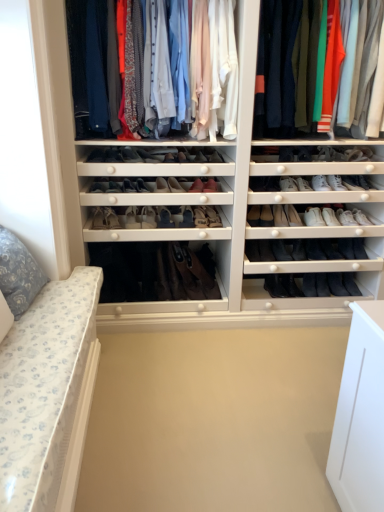
This screenshot has width=384, height=512. Describe the element at coordinates (113, 155) in the screenshot. I see `matte white shoe at center, which is the 5th shoe from left to right` at that location.

This screenshot has height=512, width=384. Describe the element at coordinates (148, 217) in the screenshot. I see `leather boot at center, which appears as the sixteenth shoe when viewed from the right` at that location.

Where is `matte cotton t-shirts at upper right, positioned as the 1th clothing in right-to-left order`? This screenshot has width=384, height=512. matte cotton t-shirts at upper right, positioned as the 1th clothing in right-to-left order is located at coordinates (291, 65).

This screenshot has height=512, width=384. In order to click on leather boot at center, placed as the 2th shoe when sorted from left to right in this screenshot , I will do `click(96, 156)`.

Locate an element on the screen. leather boot at center, the eleventh shoe when ordered from left to right is located at coordinates (161, 185).

From a real-world perspective, does black leather boot at lower center, the fourth shoe when ordered from right to left, sit lower than floral fabric pillow at left?

Indeed, from a real-world perspective, black leather boot at lower center, the fourth shoe when ordered from right to left, is positioned beneath floral fabric pillow at left.

Consider the image. Based on their positions, is black leather boot at lower center, the fourth shoe when ordered from right to left, located to the left or right of floral fabric pillow at left?

From the image, it's evident that black leather boot at lower center, the fourth shoe when ordered from right to left, is to the right of floral fabric pillow at left.

Considering the positions of objects black leather boot at lower center, the fourth shoe when ordered from right to left, and floral fabric pillow at left in the image provided, who is in front, black leather boot at lower center, the fourth shoe when ordered from right to left, or floral fabric pillow at left?

floral fabric pillow at left is more forward.

From the image's perspective, which one is positioned lower, black leather boot at lower center, acting as the 21th shoe starting from the left, or floral fabric pillow at left?

black leather boot at lower center, acting as the 21th shoe starting from the left.

Which is farther, (198, 209) or (148, 162)?

The point (198, 209) is more distant.

From a real-world perspective, is leather boot at center, placed as the eighth shoe when sorted from right to left, below matte black shoe at center, the tenth shoe positioned from the left?

Yes, from a real-world perspective, leather boot at center, placed as the eighth shoe when sorted from right to left, is below matte black shoe at center, the tenth shoe positioned from the left.

Starting from the leather boot at center, which is counted as the 17th shoe, starting from the left, which shoe is the 7th one to the left? Please provide its 2D coordinates.

[(148, 156)]

Can you confirm if leather boot at center, placed as the eighth shoe when sorted from right to left, is positioned to the right of matte black shoe at center, the tenth shoe positioned from the left?

Yes, leather boot at center, placed as the eighth shoe when sorted from right to left, is to the right of matte black shoe at center, the tenth shoe positioned from the left.

Who is taller, matte black shoe at center, which ranks as the 15th shoe in right-to-left order, or matte black shoe at center, which is the eighth shoe from left to right?

matte black shoe at center, which is the eighth shoe from left to right, is taller.

In terms of size, does matte black shoe at center, the tenth shoe positioned from the left, appear bigger or smaller than matte black shoe at center, which is the seventeenth shoe from right to left?

Clearly, matte black shoe at center, the tenth shoe positioned from the left, is smaller in size than matte black shoe at center, which is the seventeenth shoe from right to left.

From a real-world perspective, does matte black shoe at center, which ranks as the 15th shoe in right-to-left order, sit lower than matte black shoe at center, which is the eighth shoe from left to right?

No, from a real-world perspective, matte black shoe at center, which ranks as the 15th shoe in right-to-left order, is not under matte black shoe at center, which is the eighth shoe from left to right.

From a real-world perspective, is matte black boot at center, arranged as the 10th shoe when viewed from the right, under black leather boot at lower center, the fourth shoe when ordered from right to left?

Actually, matte black boot at center, arranged as the 10th shoe when viewed from the right, is physically above black leather boot at lower center, the fourth shoe when ordered from right to left, in the real world.

Considering the sizes of matte black boot at center, arranged as the 10th shoe when viewed from the right, and black leather boot at lower center, acting as the 21th shoe starting from the left, in the image, is matte black boot at center, arranged as the 10th shoe when viewed from the right, wider or thinner than black leather boot at lower center, acting as the 21th shoe starting from the left,?

In the image, matte black boot at center, arranged as the 10th shoe when viewed from the right, appears to be wider than black leather boot at lower center, acting as the 21th shoe starting from the left.

Which of these two, matte black boot at center, acting as the fifteenth shoe starting from the left, or black leather boot at lower center, the fourth shoe when ordered from right to left, is smaller?

Smaller between the two is matte black boot at center, acting as the fifteenth shoe starting from the left.

Could you tell me if matte black boot at center, arranged as the 10th shoe when viewed from the right, is facing black leather boot at lower center, acting as the 21th shoe starting from the left?

No, matte black boot at center, arranged as the 10th shoe when viewed from the right, is not facing towards black leather boot at lower center, acting as the 21th shoe starting from the left.

Does leather boot at center, which is the 6th shoe from right to left, turn towards leather boot at center, the eleventh shoe when ordered from left to right?

No, leather boot at center, which is the 6th shoe from right to left, is not aimed at leather boot at center, the eleventh shoe when ordered from left to right.

Considering the sizes of objects leather boot at center, which is the 6th shoe from right to left, and leather boot at center, the 14th shoe viewed from the right, in the image provided, who is smaller, leather boot at center, which is the 6th shoe from right to left, or leather boot at center, the 14th shoe viewed from the right,?

leather boot at center, the 14th shoe viewed from the right.

Does point (217, 219) lie in front of point (164, 186)?

Yes, it is in front of point (164, 186).

Does leather boot at center, which is the 18th shoe from left to right, have a lesser width compared to matte black shoe at center, which is the seventeenth shoe from right to left?

No, leather boot at center, which is the 18th shoe from left to right, is not thinner than matte black shoe at center, which is the seventeenth shoe from right to left.

Which shoe is the 10th one when counting from the right side of the matte black shoe at center, which is the seventeenth shoe from right to left? Please provide its 2D coordinates.

[(211, 186)]

Does leather boot at center, which is the 18th shoe from left to right, appear on the right side of matte black shoe at center, which is the eighth shoe from left to right?

Yes.

Is leather boot at center, which ranks as the eleventh shoe in right-to-left order, with matte black shoe at center, which ranks as the 15th shoe in right-to-left order?

No, leather boot at center, which ranks as the eleventh shoe in right-to-left order, is not with matte black shoe at center, which ranks as the 15th shoe in right-to-left order.

Which is correct: leather boot at center, which ranks as the eleventh shoe in right-to-left order, is inside matte black shoe at center, the tenth shoe positioned from the left, or outside of it?

leather boot at center, which ranks as the eleventh shoe in right-to-left order, is spatially situated outside matte black shoe at center, the tenth shoe positioned from the left.

Find the location of `the 4th shoe counting from the left of the leather boot at center, the fourteenth shoe when ordered from left to right`. the 4th shoe counting from the left of the leather boot at center, the fourteenth shoe when ordered from left to right is located at coordinates (148, 156).

Locate an element on the screen. pillow on the left of black leather boot at lower center, acting as the 21th shoe starting from the left is located at coordinates (x=18, y=273).

Locate an element on the screen. Image resolution: width=384 pixels, height=512 pixels. the 15th shoe positioned above the leather boot at center, which is counted as the 17th shoe, starting from the left (from a real-world perspective) is located at coordinates click(148, 156).

When comparing their distances from leather boot at center, which ranks as the eleventh shoe in right-to-left order, does leather boot at center, the 21th shoe viewed from the right, or black leather boot at lower center, acting as the 21th shoe starting from the left, seem further?

black leather boot at lower center, acting as the 21th shoe starting from the left, is positioned further to the anchor leather boot at center, which ranks as the eleventh shoe in right-to-left order.

Which object lies further to the anchor point leather shoes at center, which ranks as the 22th shoe in right-to-left order, black leather shoe at lower right, the 3th shoe viewed from the right, or matte cotton t-shirts at upper right, placed as the 2th clothing when sorted from left to right?

Based on the image, matte cotton t-shirts at upper right, placed as the 2th clothing when sorted from left to right, appears to be further to leather shoes at center, which ranks as the 22th shoe in right-to-left order.

From the image, which object appears to be farther from matte black boot at center, acting as the fifteenth shoe starting from the left, matte black shoe at center, which ranks as the 15th shoe in right-to-left order, or black leather shoe at lower right, the 3th shoe viewed from the right?

Among the two, black leather shoe at lower right, the 3th shoe viewed from the right, is located further to matte black boot at center, acting as the fifteenth shoe starting from the left.

Looking at the image, which one is located further to matte black boot at center, arranged as the 10th shoe when viewed from the right, black leather shoe at lower right, which is the 22th shoe from left to right, or matte black shoe at center, arranged as the 19th shoe when viewed from the right?

Among the two, black leather shoe at lower right, which is the 22th shoe from left to right, is located further to matte black boot at center, arranged as the 10th shoe when viewed from the right.

From the image, which object appears to be nearer to matte fabric shirts at upper center, positioned as the 2th clothing in right-to-left order, leather boot at center, which is the 18th shoe from left to right, or leather boot at center, positioned as the 5th shoe in right-to-left order?

leather boot at center, positioned as the 5th shoe in right-to-left order, is closer to matte fabric shirts at upper center, positioned as the 2th clothing in right-to-left order.

Estimate the real-world distances between objects in this image. Which object is closer to floral fabric pillow at left, matte black shoe at center, which is the seventeenth shoe from right to left, or leather shoes at center, which ranks as the 22th shoe in right-to-left order?

leather shoes at center, which ranks as the 22th shoe in right-to-left order, is positioned closer to the anchor floral fabric pillow at left.

When comparing their distances from brown suede boot at center, does matte black shoe at center, which is the seventeenth shoe from right to left, or leather boot at center, which ranks as the eleventh shoe in right-to-left order, seem closer?

Based on the image, leather boot at center, which ranks as the eleventh shoe in right-to-left order, appears to be nearer to brown suede boot at center.

Based on their spatial positions, is leather boot at center, which is the ninth shoe in left-to-right order, or leather boot at center, which is counted as the 17th shoe, starting from the left, closer to black leather shoe at lower right, the 3th shoe viewed from the right?

leather boot at center, which is counted as the 17th shoe, starting from the left, lies closer to black leather shoe at lower right, the 3th shoe viewed from the right, than the other object.

Find the location of a particular element. The height and width of the screenshot is (512, 384). footwear located between leather boot at center, the fourteenth shoe when ordered from left to right, and white leather shoe at center right, the 24th shoe in the left-to-right sequence, in the left-right direction is located at coordinates (184, 273).

Where is `footwear located between matte black shoe at center, the tenth shoe positioned from the left, and black suede shoe at lower center, which ranks as the second shoe in right-to-left order, in the left-right direction`? The height and width of the screenshot is (512, 384). footwear located between matte black shoe at center, the tenth shoe positioned from the left, and black suede shoe at lower center, which ranks as the second shoe in right-to-left order, in the left-right direction is located at coordinates (184, 273).

Identify the location of footwear situated between leather tan boot at center, positioned as the eighteenth shoe in right-to-left order, and black suede shoe at lower center, the 23th shoe in the left-to-right sequence, from left to right. Image resolution: width=384 pixels, height=512 pixels. (184, 273).

Where is `footwear between matte black shoe at center, which ranks as the 15th shoe in right-to-left order, and black leather shoe at lower right, which is the 22th shoe from left to right`? This screenshot has height=512, width=384. footwear between matte black shoe at center, which ranks as the 15th shoe in right-to-left order, and black leather shoe at lower right, which is the 22th shoe from left to right is located at coordinates (184, 273).